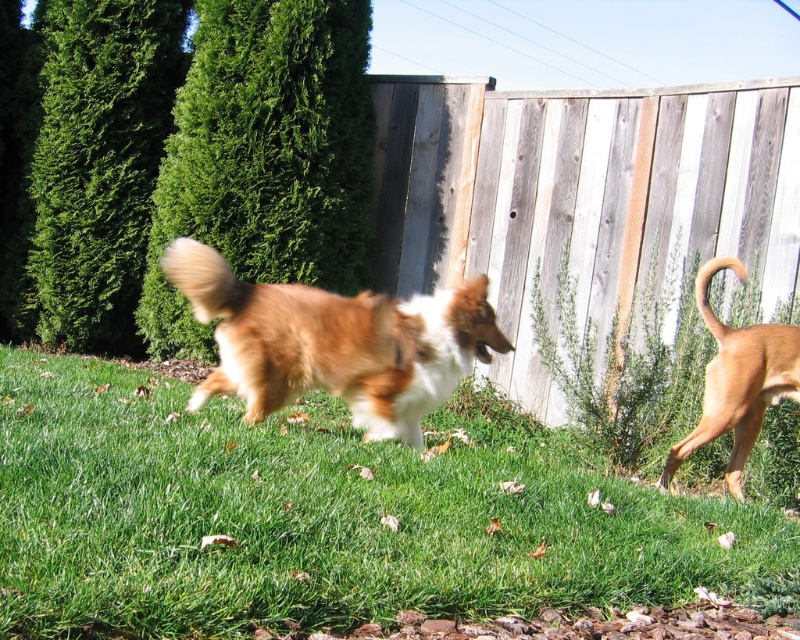
Which of these two, green grass at center or brown fluffy tail at center, stands taller?

green grass at center

Can you confirm if green grass at center is positioned to the right of brown fluffy tail at center?

Indeed, green grass at center is positioned on the right side of brown fluffy tail at center.

Measure the distance between green grass at center and camera.

green grass at center and camera are 1.95 meters apart.

At what (x,y) coordinates should I click in order to perform the action: click on green grass at center. Please return your answer as a coordinate pair (x, y). The image size is (800, 640). Looking at the image, I should click on (316, 516).

Based on the photo, how far apart are brown furry dog at right and brown furry tail at right?

They are 11.54 inches apart.

Identify the location of brown furry dog at right. (737, 380).

This screenshot has height=640, width=800. In order to click on brown furry dog at right in this screenshot , I will do `click(737, 380)`.

Based on the photo, is green grass at center to the right of brown furry tail at right from the viewer's perspective?

No, green grass at center is not to the right of brown furry tail at right.

This screenshot has height=640, width=800. Describe the element at coordinates (316, 516) in the screenshot. I see `green grass at center` at that location.

Is point (500, 472) farther from viewer compared to point (740, 268)?

No, it is not.

Identify the location of green grass at center. point(316,516).